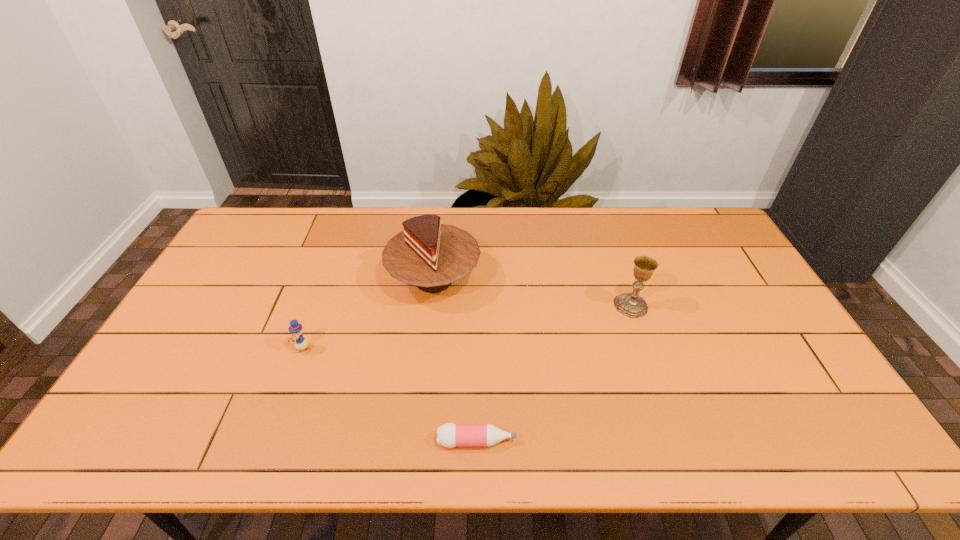
Find the location of `object positioned at the near edge`. object positioned at the near edge is located at coordinates (449, 435).

Where is `vacant region at the far edge`? This screenshot has height=540, width=960. vacant region at the far edge is located at coordinates (676, 239).

You are a GUI agent. You are given a task and a screenshot of the screen. Output one action in this format:
    pyautogui.click(x=<x>, y=<y>)
    Task: Click on the free spot at the near edge of the desktop
    
    Given the screenshot: What is the action you would take?
    (x=184, y=435)

You are a GUI agent. You are given a task and a screenshot of the screen. Output one action in this format:
    pyautogui.click(x=<x>, y=<y>)
    Task: Click on the free spot at the left edge of the desktop
    
    Given the screenshot: What is the action you would take?
    pyautogui.click(x=253, y=267)

Find the location of a particular element. free space at the right edge of the desktop is located at coordinates pos(760,391).

In the image, there is a desktop. Where is `vacant space at the far left corner`? The height and width of the screenshot is (540, 960). vacant space at the far left corner is located at coordinates (266, 241).

Locate an element on the screen. vacant point located between the bottle and the cake is located at coordinates (455, 360).

Identify the location of vacant region between the shortest object and the cake. The height and width of the screenshot is (540, 960). (455, 360).

At what (x,y) coordinates should I click in order to perform the action: click on empty space that is in between the chalice and the bottle. Please return your answer as a coordinate pair (x, y). The height and width of the screenshot is (540, 960). Looking at the image, I should click on (554, 373).

I want to click on free space between the shortest object and the cake, so click(x=455, y=360).